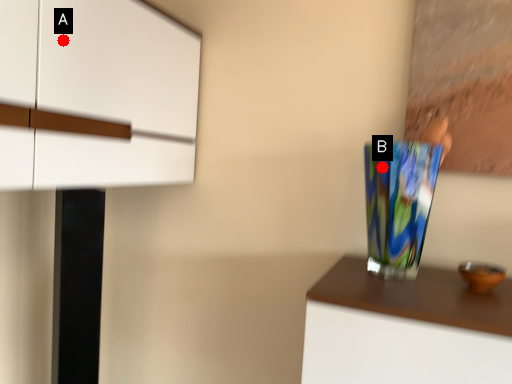
Question: Two points are circled on the image, labeled by A and B beside each circle. Which point is farther to the camera?

Choices:
 (A) A is further
 (B) B is further

Answer: (B)